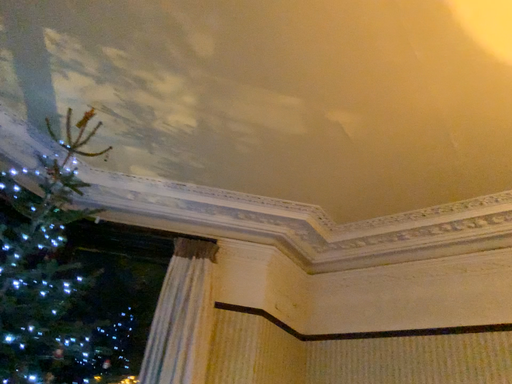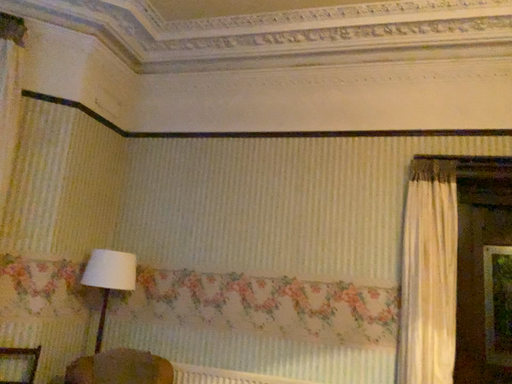
Question: How did the camera likely rotate when shooting the video?

Choices:
 (A) rotated right
 (B) rotated left

Answer: (A)